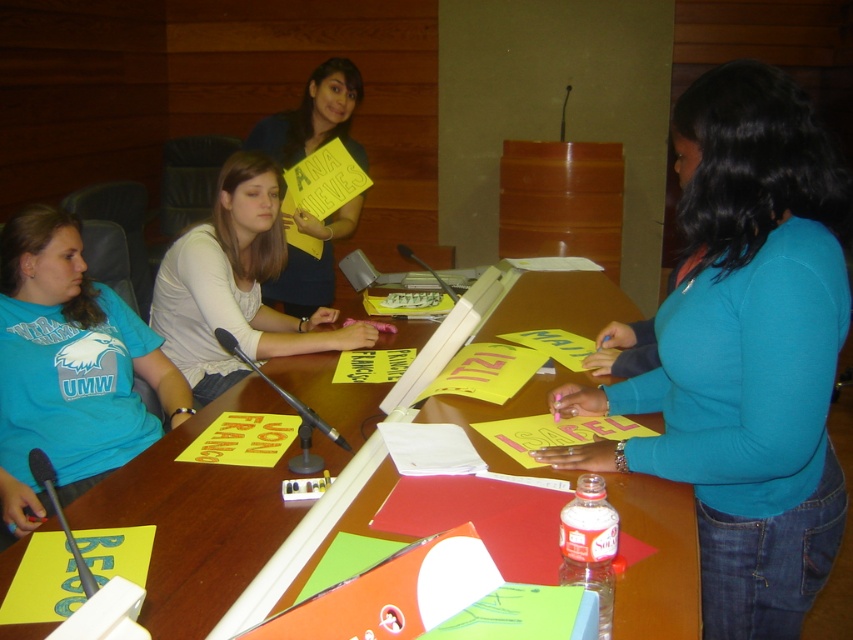
You are organizing a small workshop and need to set up two microphones. You have two black plastic microphones available. The first one is the black plastic microphone at lower left, and the second is the black plastic microphone at center. Based on the image, which microphone should you choose if you want the one that takes up more space?

The black plastic microphone at center takes up more space, so you should choose the black plastic microphone at center.